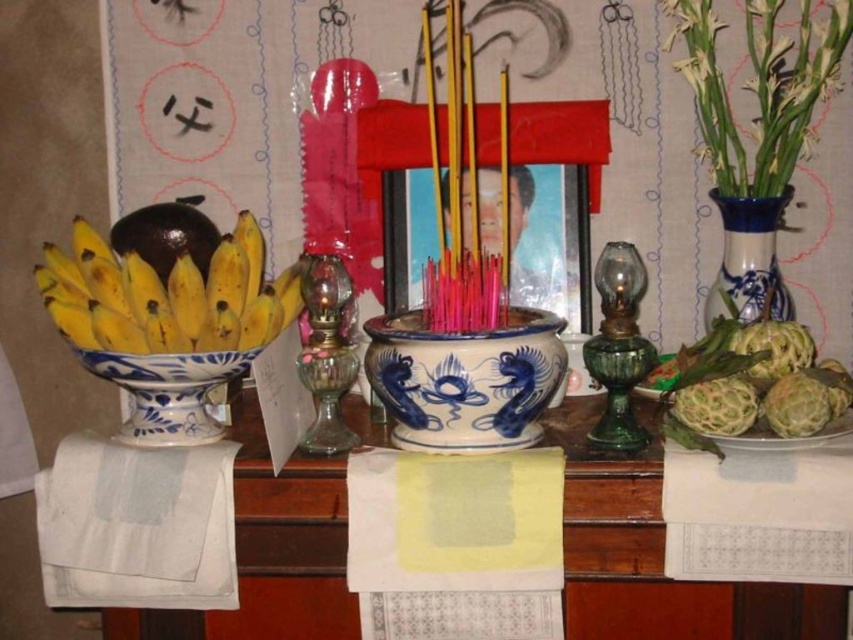
Can you confirm if blue and white ceramic bowl at center is thinner than blue and white porcelain bowl at left?

Incorrect, blue and white ceramic bowl at center's width is not less than blue and white porcelain bowl at left's.

Is point (415, 328) closer to viewer compared to point (106, 355)?

No.

Is point (419, 317) closer to camera compared to point (184, 417)?

No, it is not.

Locate an element on the screen. blue and white ceramic bowl at center is located at coordinates (465, 380).

Find the location of a particular element. The width and height of the screenshot is (853, 640). white cotton cloth at lower left is located at coordinates coord(137,525).

Is white cotton cloth at lower left positioned before transparent glass candle holder at center?

Yes, it is in front of transparent glass candle holder at center.

Between point (44, 492) and point (317, 428), which one is positioned in front?

Point (44, 492) is in front.

Identify the location of white cotton cloth at lower left. This screenshot has width=853, height=640. (137, 525).

Does transparent glass candle holder at center lie in front of blue and white ceramic vase at right?

Yes, it is.

Does transparent glass candle holder at center appear on the right side of blue and white ceramic vase at right?

In fact, transparent glass candle holder at center is to the left of blue and white ceramic vase at right.

I want to click on transparent glass candle holder at center, so (x=326, y=353).

You are a GUI agent. You are given a task and a screenshot of the screen. Output one action in this format:
    pyautogui.click(x=<x>, y=<y>)
    Task: Click on the transparent glass candle holder at center
    This screenshot has width=853, height=640.
    Given the screenshot: What is the action you would take?
    pyautogui.click(x=326, y=353)